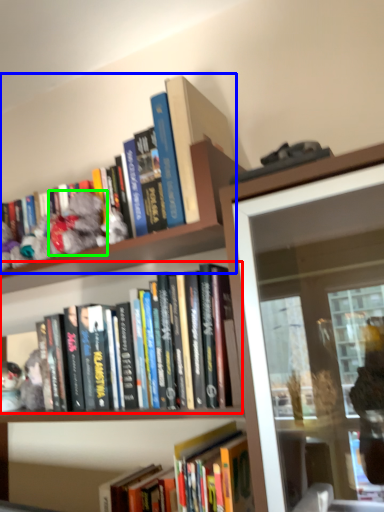
Question: Which object is positioned farthest from book (highlighted by a red box)? Select from book (highlighted by a blue box) and toy (highlighted by a green box).

Choices:
 (A) book
 (B) toy

Answer: (B)